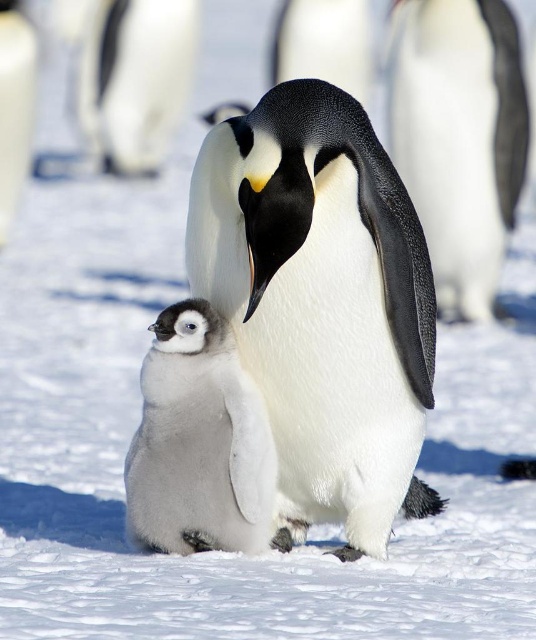
Question: Is the position of black matte penguin at center less distant than that of white fluffy penguin chick at left?

Choices:
 (A) yes
 (B) no

Answer: (B)

Question: Is black matte penguin at center to the right of white fluffy penguin chick at left from the viewer's perspective?

Choices:
 (A) no
 (B) yes

Answer: (B)

Question: Among these points, which one is farthest from the camera?

Choices:
 (A) (319, 509)
 (B) (319, 22)
 (C) (130, 472)
 (D) (418, 198)

Answer: (B)

Question: Is white fluffy penguin at upper left further to the viewer compared to black matte penguin at center?

Choices:
 (A) yes
 (B) no

Answer: (A)

Question: Which object is closer to the camera taking this photo?

Choices:
 (A) white fluffy penguin chick at center
 (B) white fluffy penguin at upper left
 (C) white fluffy penguin at center
 (D) white matte penguin at upper right

Answer: (C)

Question: Which is nearer to the white fluffy penguin chick at left?

Choices:
 (A) white fluffy penguin at center
 (B) white matte penguin at upper right

Answer: (B)